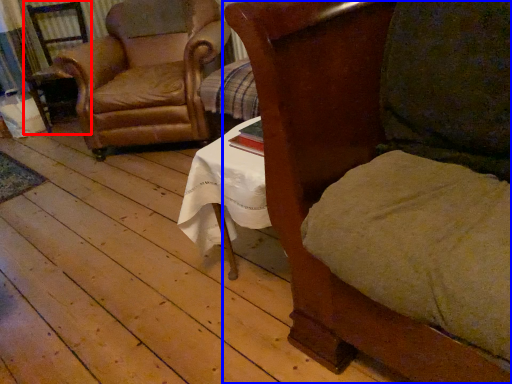
Question: Which of the following is the farthest to the observer, armchair (highlighted by a red box) or chair (highlighted by a blue box)?

Choices:
 (A) armchair
 (B) chair

Answer: (A)